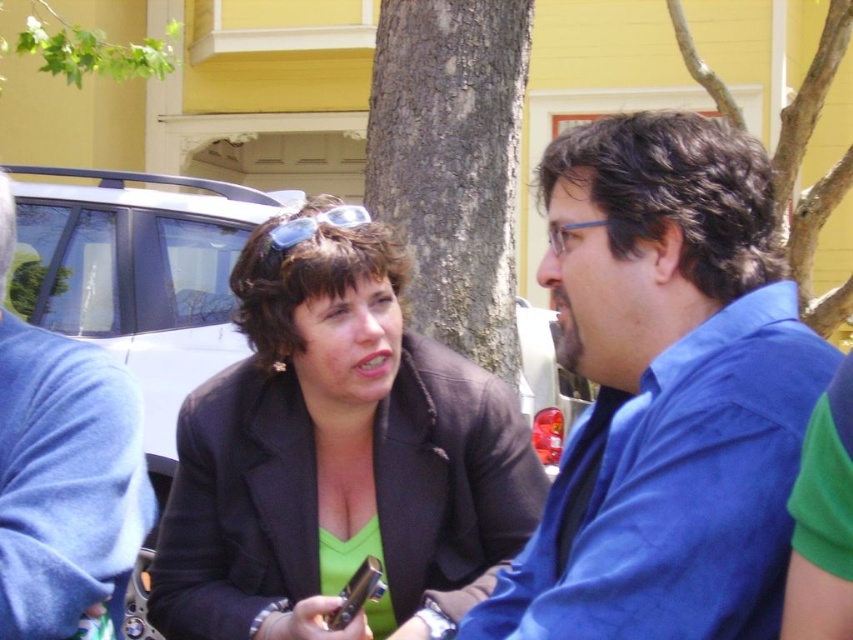
Identify the location of blue cotton shirt at center. The height and width of the screenshot is (640, 853). (665, 392).

Based on the photo, can you confirm if blue cotton shirt at center is smaller than brown textured tree trunk at center?

Indeed, blue cotton shirt at center has a smaller size compared to brown textured tree trunk at center.

What do you see at coordinates (665, 392) in the screenshot?
I see `blue cotton shirt at center` at bounding box center [665, 392].

I want to click on blue cotton shirt at center, so click(x=665, y=392).

Can you confirm if brown rough bark tree at center is taller than blue plastic goggles at center?

Correct, brown rough bark tree at center is much taller as blue plastic goggles at center.

Can you confirm if brown rough bark tree at center is thinner than blue plastic goggles at center?

Incorrect, brown rough bark tree at center's width is not less than blue plastic goggles at center's.

Where is `brown rough bark tree at center`? Image resolution: width=853 pixels, height=640 pixels. brown rough bark tree at center is located at coordinates (451, 163).

Image resolution: width=853 pixels, height=640 pixels. I want to click on brown rough bark tree at center, so pos(451,163).

Is matte black blazer at center shorter than green leafy branch at upper left?

No, matte black blazer at center is not shorter than green leafy branch at upper left.

You are a GUI agent. You are given a task and a screenshot of the screen. Output one action in this format:
    pyautogui.click(x=<x>, y=<y>)
    Task: Click on the matte black blazer at center
    The image size is (853, 640).
    Given the screenshot: What is the action you would take?
    pyautogui.click(x=337, y=456)

The height and width of the screenshot is (640, 853). What do you see at coordinates (337, 456) in the screenshot?
I see `matte black blazer at center` at bounding box center [337, 456].

Where is `matte black blazer at center`? matte black blazer at center is located at coordinates (337, 456).